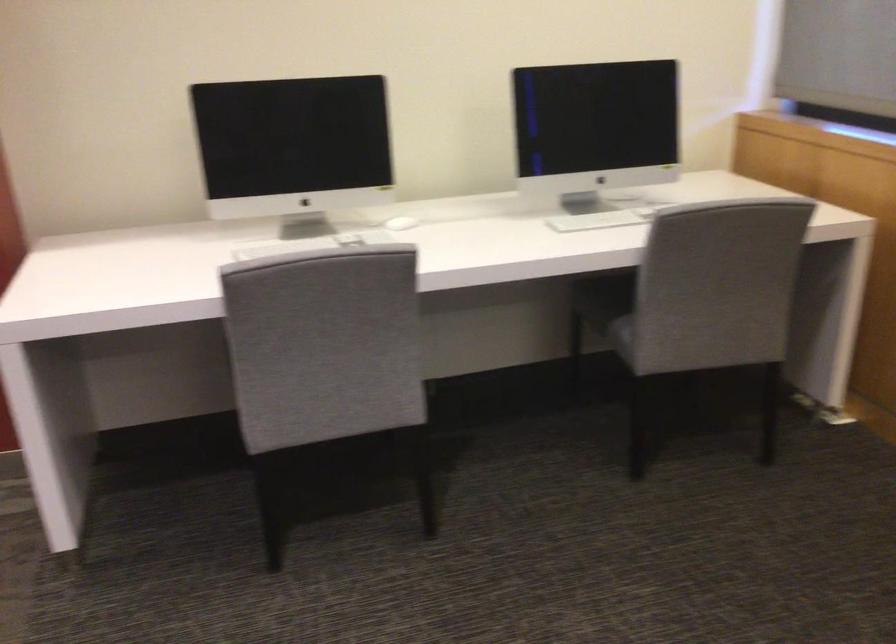
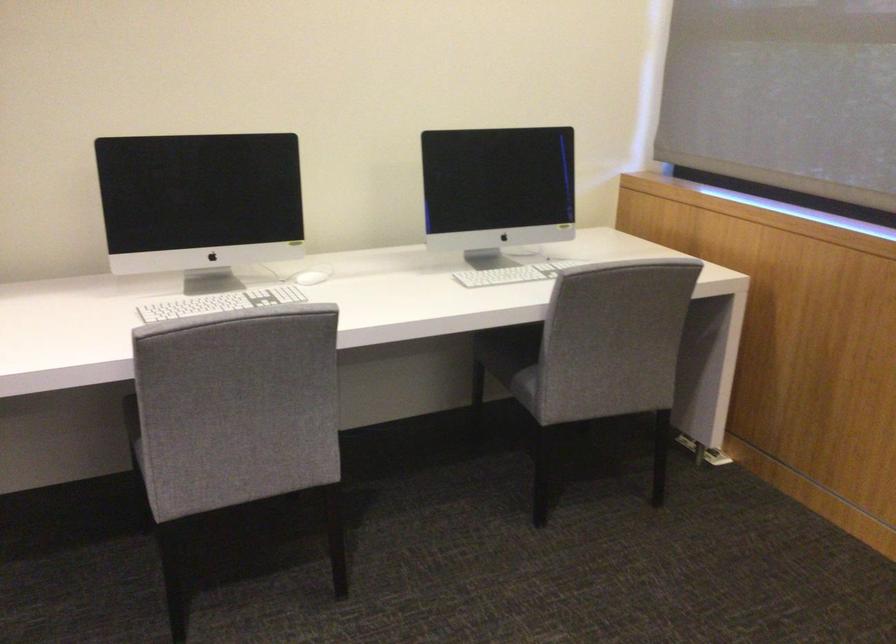
In the second image, find the point that corresponds to pixel 316 243 in the first image.

(220, 303)